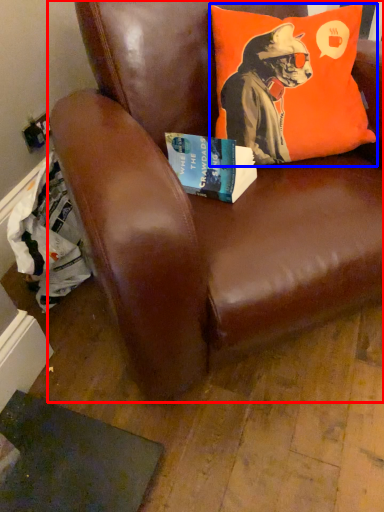
Question: Among these objects, which one is farthest to the camera, chair (highlighted by a red box) or pillow (highlighted by a blue box)?

Choices:
 (A) chair
 (B) pillow

Answer: (B)